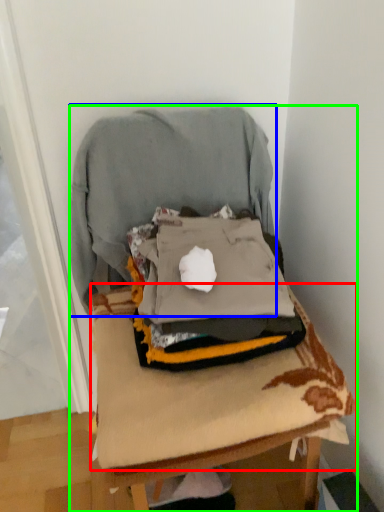
Question: Considering the real-world distances, which object is closest to sheet (highlighted by a red box)? sweatshirt (highlighted by a blue box) or furniture (highlighted by a green box).

Choices:
 (A) sweatshirt
 (B) furniture

Answer: (B)